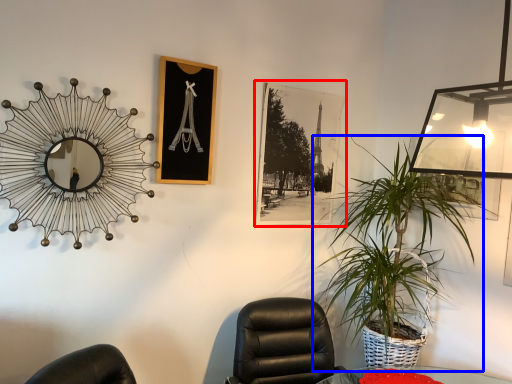
Question: Among these objects, which one is nearest to the camera, picture frame (highlighted by a red box) or houseplant (highlighted by a blue box)?

Choices:
 (A) picture frame
 (B) houseplant

Answer: (B)